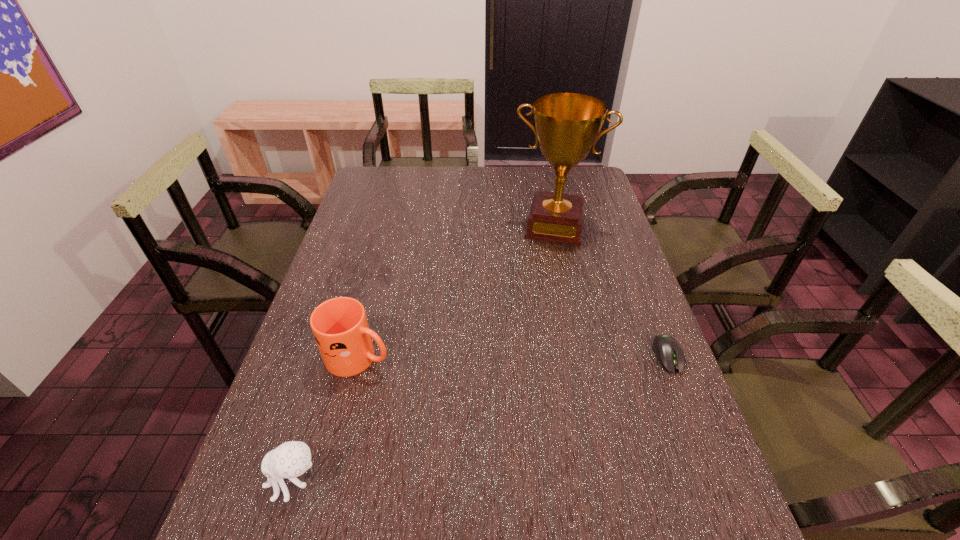
At what (x,y) coordinates should I click in order to perform the action: click on octopus. Please return your answer as a coordinate pair (x, y). The image size is (960, 540). Looking at the image, I should click on (291, 459).

Where is `the second shortest object`? the second shortest object is located at coordinates (291, 459).

Where is `computer mouse`? The height and width of the screenshot is (540, 960). computer mouse is located at coordinates (669, 353).

The height and width of the screenshot is (540, 960). In order to click on the shortest object in this screenshot , I will do `click(669, 353)`.

This screenshot has height=540, width=960. I want to click on mug, so click(x=340, y=327).

I want to click on the farthest object, so click(x=567, y=125).

At what (x,y) coordinates should I click in order to perform the action: click on award. Please return your answer as a coordinate pair (x, y). Image resolution: width=960 pixels, height=540 pixels. Looking at the image, I should click on (567, 125).

Locate an element on the screen. The width and height of the screenshot is (960, 540). vacant space located 0.240m on the wheel side of the rightmost object is located at coordinates (715, 476).

Locate an element on the screen. The width and height of the screenshot is (960, 540). vacant space located 0.210m on the handle side of the second tallest object is located at coordinates (470, 389).

I want to click on vacant space located on the handle side of the second tallest object, so click(x=420, y=373).